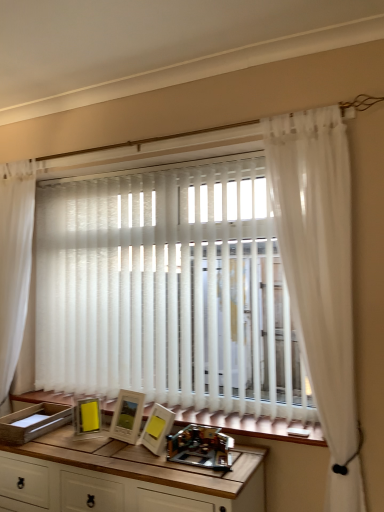
This screenshot has width=384, height=512. I want to click on free region on the left part of metallic plastic toy at center, so click(x=150, y=461).